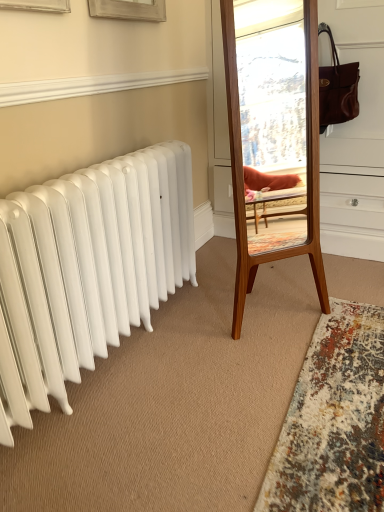
Question: Is wooden mirror at center oriented towards multicolored shaggy rug at lower right?

Choices:
 (A) yes
 (B) no

Answer: (A)

Question: Is wooden mirror at center taller than multicolored shaggy rug at lower right?

Choices:
 (A) yes
 (B) no

Answer: (A)

Question: From the image's perspective, is wooden mirror at center on multicolored shaggy rug at lower right?

Choices:
 (A) yes
 (B) no

Answer: (A)

Question: Is wooden mirror at center outside multicolored shaggy rug at lower right?

Choices:
 (A) no
 (B) yes

Answer: (B)

Question: Considering the relative sizes of wooden mirror at center and multicolored shaggy rug at lower right in the image provided, is wooden mirror at center smaller than multicolored shaggy rug at lower right?

Choices:
 (A) no
 (B) yes

Answer: (A)

Question: Can you confirm if wooden mirror at center is wider than multicolored shaggy rug at lower right?

Choices:
 (A) no
 (B) yes

Answer: (A)

Question: Is white smooth baseboard at upper center taller than multicolored shaggy rug at lower right?

Choices:
 (A) yes
 (B) no

Answer: (A)

Question: From the image's perspective, is white smooth baseboard at upper center located beneath multicolored shaggy rug at lower right?

Choices:
 (A) no
 (B) yes

Answer: (A)

Question: Is white smooth baseboard at upper center further to camera compared to multicolored shaggy rug at lower right?

Choices:
 (A) no
 (B) yes

Answer: (B)

Question: Can you confirm if white smooth baseboard at upper center is wider than multicolored shaggy rug at lower right?

Choices:
 (A) no
 (B) yes

Answer: (A)

Question: Considering the relative sizes of white smooth baseboard at upper center and multicolored shaggy rug at lower right in the image provided, is white smooth baseboard at upper center shorter than multicolored shaggy rug at lower right?

Choices:
 (A) yes
 (B) no

Answer: (B)

Question: Would you say white smooth baseboard at upper center is outside multicolored shaggy rug at lower right?

Choices:
 (A) no
 (B) yes

Answer: (B)

Question: From a real-world perspective, is multicolored shaggy rug at lower right on top of white smooth baseboard at upper center?

Choices:
 (A) yes
 (B) no

Answer: (B)